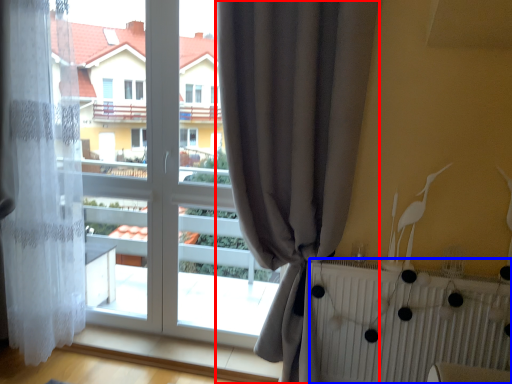
Question: Which point is further to the camera, curtain (highlighted by a red box) or radiator (highlighted by a blue box)?

Choices:
 (A) curtain
 (B) radiator

Answer: (B)